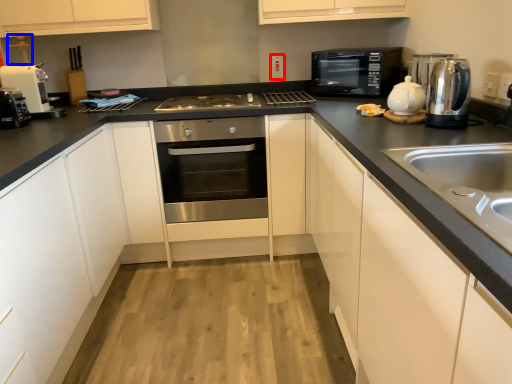
Question: Which point is further to the camera, electric outlet (highlighted by a red box) or faucet (highlighted by a blue box)?

Choices:
 (A) electric outlet
 (B) faucet

Answer: (A)